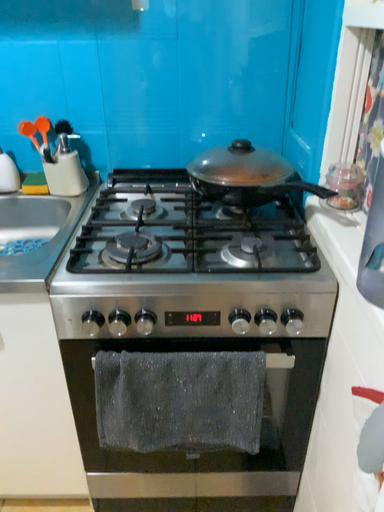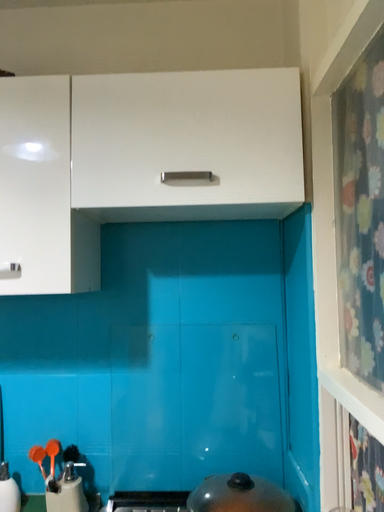
Question: Which way did the camera rotate in the video?

Choices:
 (A) rotated downward
 (B) rotated upward

Answer: (B)